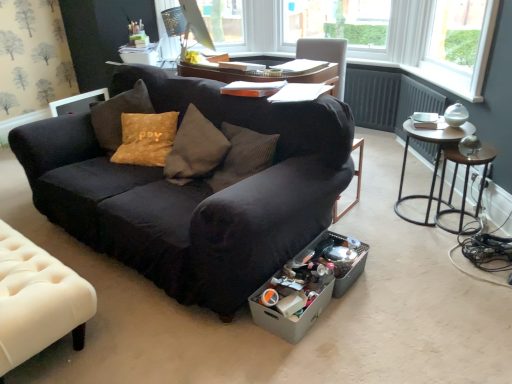
Question: From a real-world perspective, is gray cardboard box at lower center over white tufted leather at lower left?

Choices:
 (A) no
 (B) yes

Answer: (A)

Question: Considering the relative positions of gray cardboard box at lower center and white tufted leather at lower left in the image provided, is gray cardboard box at lower center to the left of white tufted leather at lower left from the viewer's perspective?

Choices:
 (A) yes
 (B) no

Answer: (B)

Question: Can you see gray cardboard box at lower center touching white tufted leather at lower left?

Choices:
 (A) yes
 (B) no

Answer: (B)

Question: Considering the relative sizes of gray cardboard box at lower center and white tufted leather at lower left in the image provided, is gray cardboard box at lower center taller than white tufted leather at lower left?

Choices:
 (A) yes
 (B) no

Answer: (B)

Question: Is gray cardboard box at lower center closer to the viewer compared to white tufted leather at lower left?

Choices:
 (A) yes
 (B) no

Answer: (B)

Question: From a real-world perspective, is gray cardboard box at lower center positioned under white tufted leather at lower left based on gravity?

Choices:
 (A) yes
 (B) no

Answer: (A)

Question: Is black fabric couch at center behind gray cardboard box at lower center?

Choices:
 (A) yes
 (B) no

Answer: (B)

Question: Can you confirm if black fabric couch at center is positioned to the right of gray cardboard box at lower center?

Choices:
 (A) yes
 (B) no

Answer: (B)

Question: Does black fabric couch at center have a greater height compared to gray cardboard box at lower center?

Choices:
 (A) no
 (B) yes

Answer: (B)

Question: Can you confirm if black fabric couch at center is thinner than gray cardboard box at lower center?

Choices:
 (A) no
 (B) yes

Answer: (A)

Question: Is black fabric couch at center facing towards gray cardboard box at lower center?

Choices:
 (A) no
 (B) yes

Answer: (A)

Question: From the image's perspective, does black fabric couch at center appear higher than gray cardboard box at lower center?

Choices:
 (A) no
 (B) yes

Answer: (B)

Question: Are metallic brown side table at right and matte black monitor at upper center far apart?

Choices:
 (A) no
 (B) yes

Answer: (B)